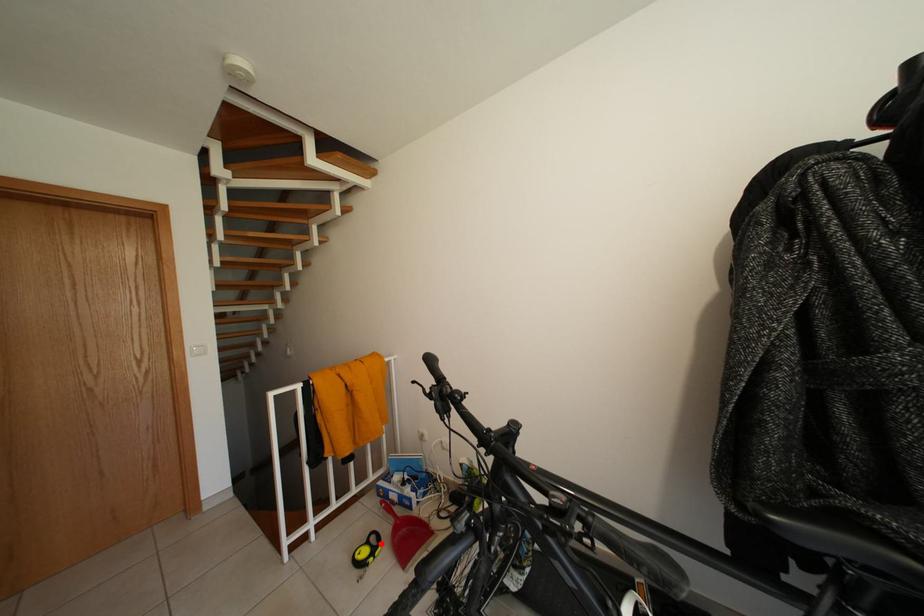
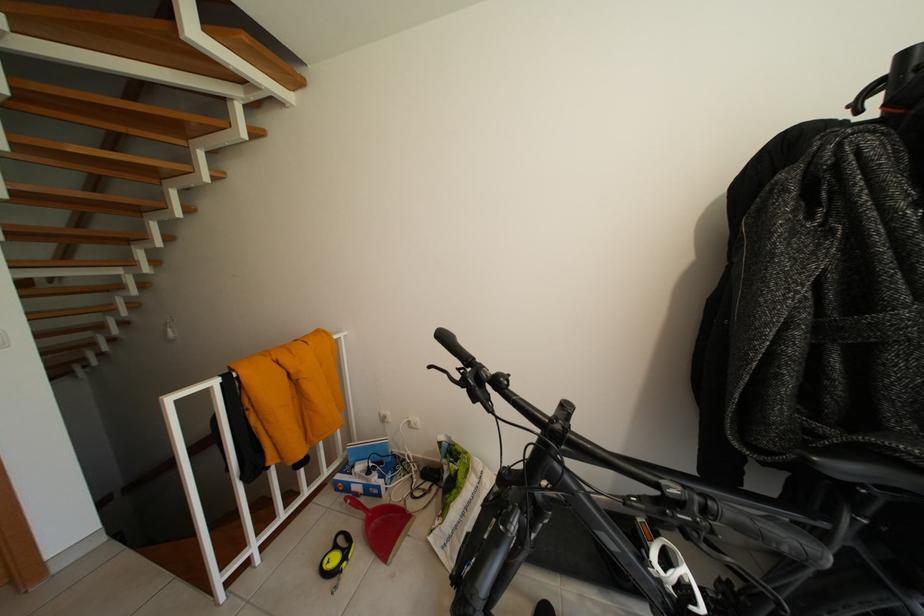
Question: I am providing you with two images of the same scene from different viewpoints. In image1, a red point is highlighted. Considering the same 3D point in image2, which of the following is correct?

Choices:
 (A) It is closer
 (B) It is farther

Answer: (A)